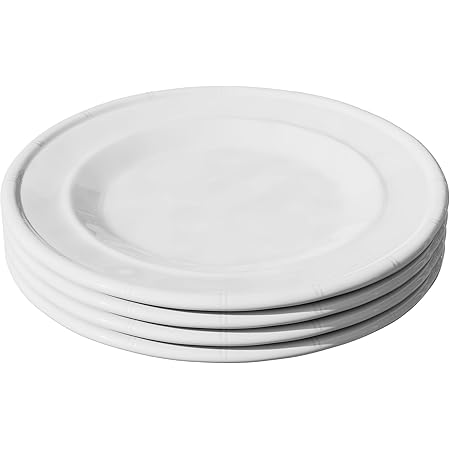
Locate an element on the screen. white plates is located at coordinates (208, 297), (208, 319), (208, 340), (206, 354).